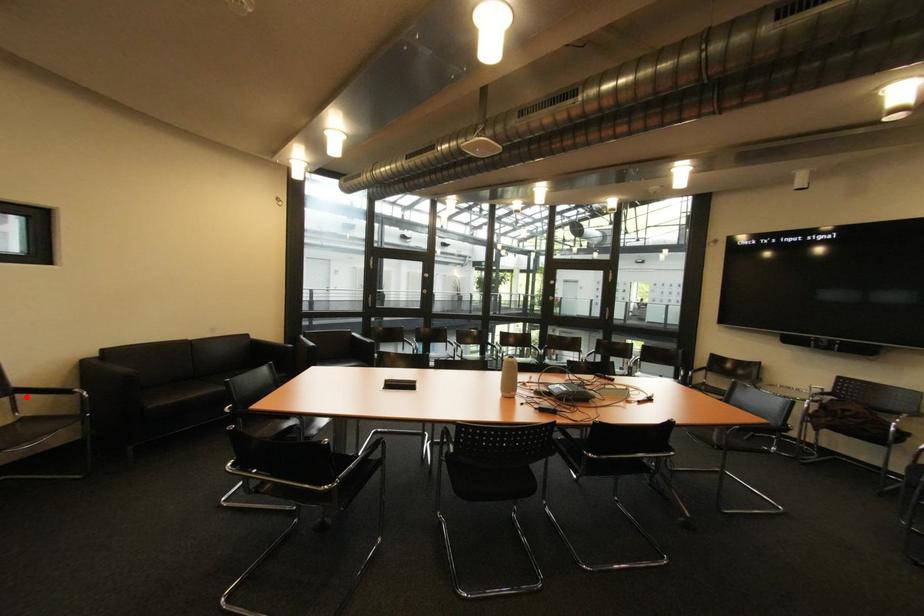
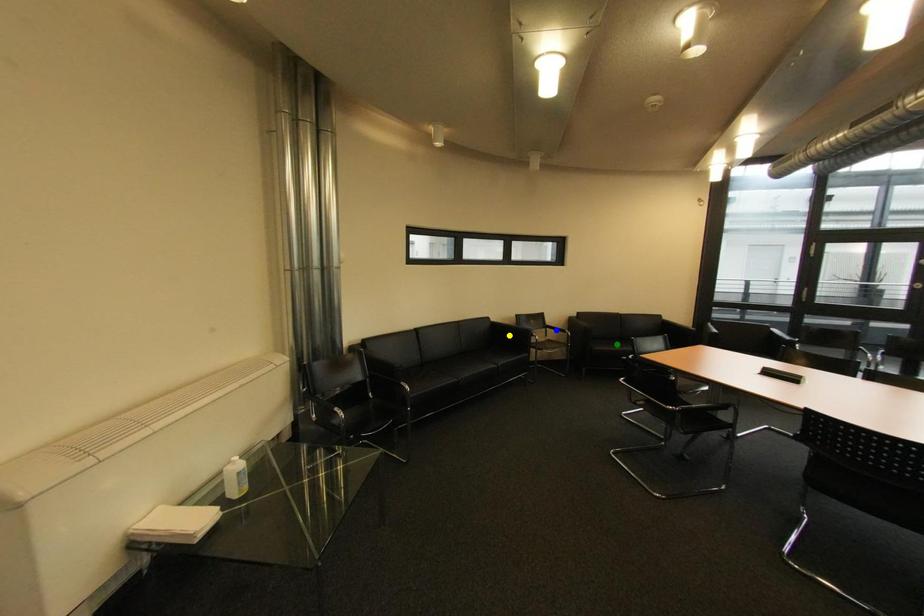
Question: I am providing you with two images of the same scene from different viewpoints. A red point is marked on the first image. You are given multiple points on the second image. Can you choose the point in image 2 that corresponds to the point in image 1?

Choices:
 (A) blue point
 (B) yellow point
 (C) green point

Answer: (A)